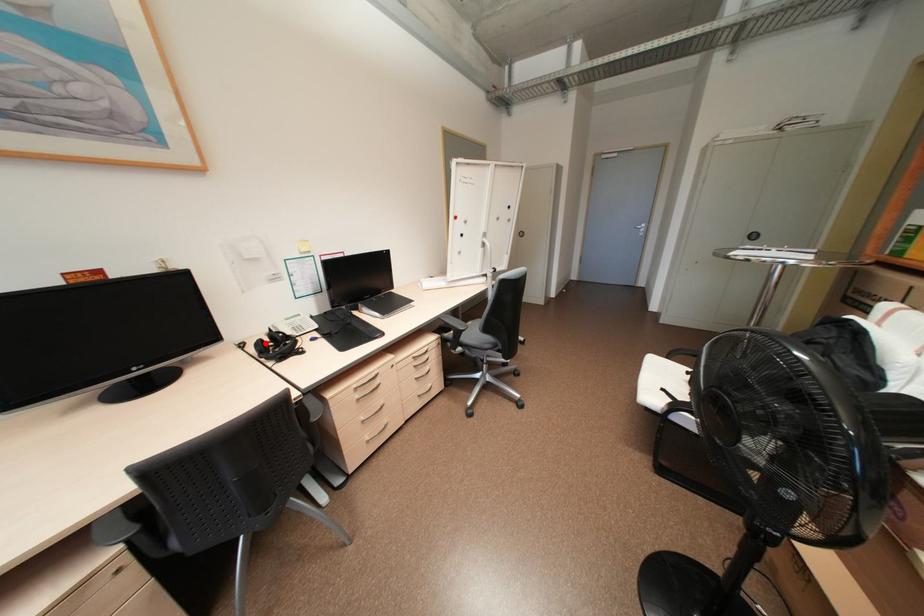
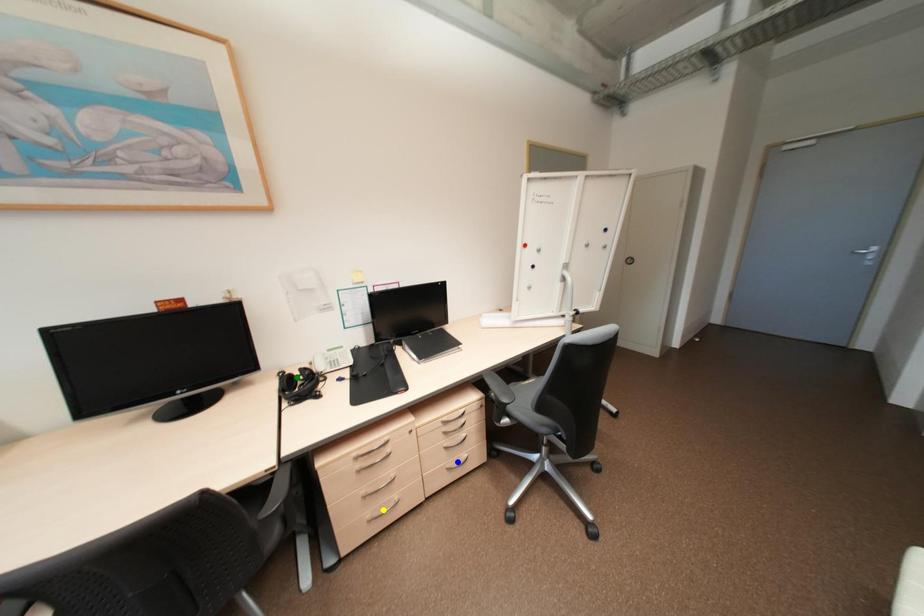
Question: I am providing you with two images of the same scene from different viewpoints. A red point is marked on the first image. You are given multiple points on the second image. Which spot in image 2 lines up with the point in image 1?

Choices:
 (A) green point
 (B) yellow point
 (C) blue point

Answer: (A)